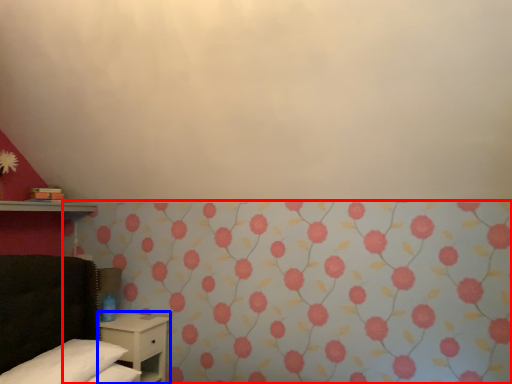
Question: Among these objects, which one is farthest to the camera, curtain (highlighted by a red box) or nightstand (highlighted by a blue box)?

Choices:
 (A) curtain
 (B) nightstand

Answer: (B)